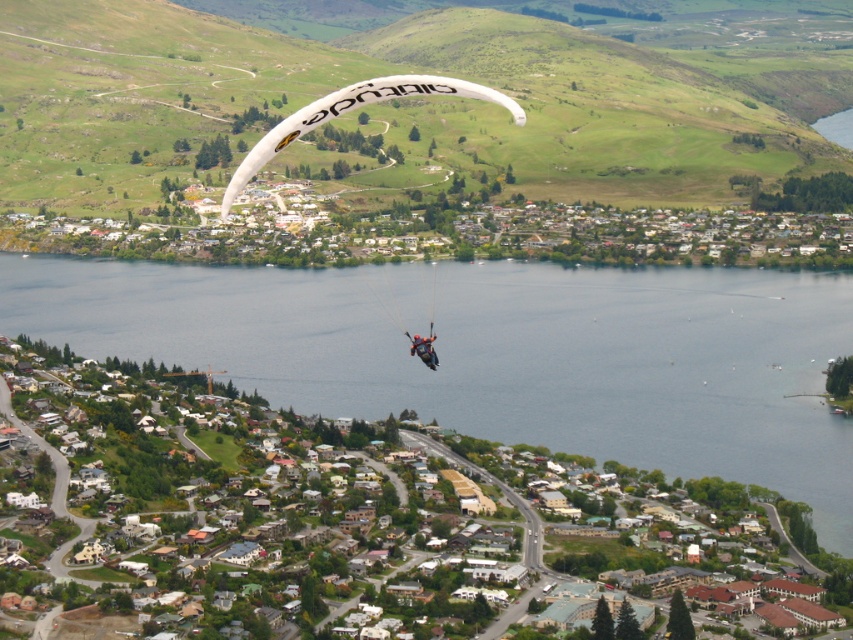
In the scene shown: You are a pilot in the white fabric parachute at center and want to know if you can safely pass under a bridge that is 10 meters tall. The dark blue fabric parachute at center is currently below you. Can you safely pass under the bridge?

The white fabric parachute at center is much taller than the dark blue fabric parachute at center. Since the dark blue fabric parachute at center is below you, the white fabric parachute at center may not be able to safely pass under the bridge that is 10 meters tall because its height exceeds the clearance.

You are a paraglider pilot navigating over the town. You notice two points marked on your map at coordinates point (281, 99) and point (374, 77). According to the map, which point is located further away from your current position?

Point (281, 99) is behind point (374, 77), so it is further away from your current position.